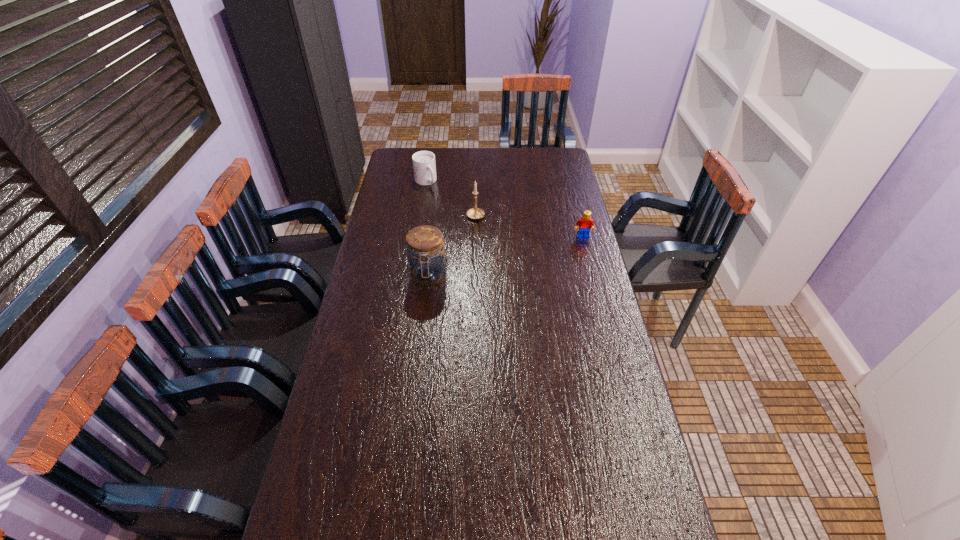
You are a GUI agent. You are given a task and a screenshot of the screen. Output one action in this format:
    pyautogui.click(x=<x>, y=<y>)
    Task: Click on the jar
    This screenshot has height=540, width=960.
    Given the screenshot: What is the action you would take?
    pyautogui.click(x=427, y=264)

Image resolution: width=960 pixels, height=540 pixels. I want to click on Lego, so click(585, 223).

Locate an element on the screen. the second nearest object is located at coordinates (585, 223).

This screenshot has height=540, width=960. Find the location of `cappuccino`. cappuccino is located at coordinates (424, 166).

Identify the location of the third nearest object. The height and width of the screenshot is (540, 960). (475, 213).

Locate an element on the screen. candle holder is located at coordinates (475, 213).

Find the location of a particular element. vacant region located on the lid of the nearest object is located at coordinates tap(418, 368).

Find the location of `free space located 0.240m on the front-facing side of the third farthest object`. free space located 0.240m on the front-facing side of the third farthest object is located at coordinates (594, 280).

At what (x,y) coordinates should I click in order to perform the action: click on vacant space located 0.180m on the side with the handle of the farthest object. Please return your answer as a coordinate pair (x, y). The image size is (960, 540). Looking at the image, I should click on (445, 210).

Where is `vacant space located 0.320m on the side with the handle of the farthest object`? This screenshot has width=960, height=540. vacant space located 0.320m on the side with the handle of the farthest object is located at coordinates (459, 227).